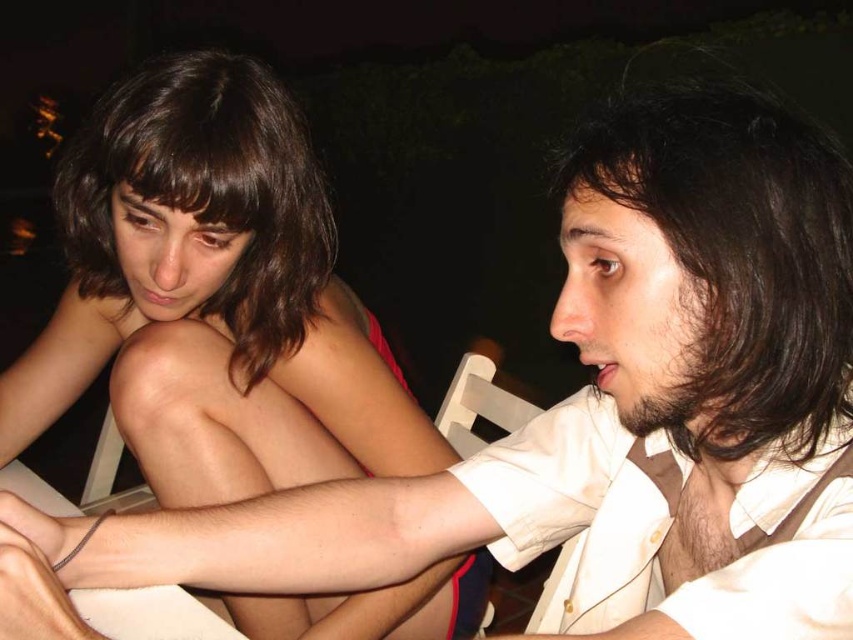
Question: Is brown hair at upper left smaller than dark brown wavy hair at upper left?

Choices:
 (A) yes
 (B) no

Answer: (B)

Question: Is brown hair at upper left thinner than dark brown wavy hair at right?

Choices:
 (A) yes
 (B) no

Answer: (B)

Question: Which object is farther from the camera taking this photo?

Choices:
 (A) dark brown wavy hair at upper left
 (B) dark brown wavy hair at right
 (C) brown hair at upper left

Answer: (A)

Question: Is brown hair at upper left thinner than dark brown wavy hair at right?

Choices:
 (A) yes
 (B) no

Answer: (B)

Question: Which object is farther from the camera taking this photo?

Choices:
 (A) dark brown wavy hair at upper left
 (B) brown hair at upper left
 (C) dark brown wavy hair at right

Answer: (A)

Question: Which point is farther from the camera taking this photo?

Choices:
 (A) (720, 250)
 (B) (196, 60)
 (C) (253, 634)

Answer: (C)